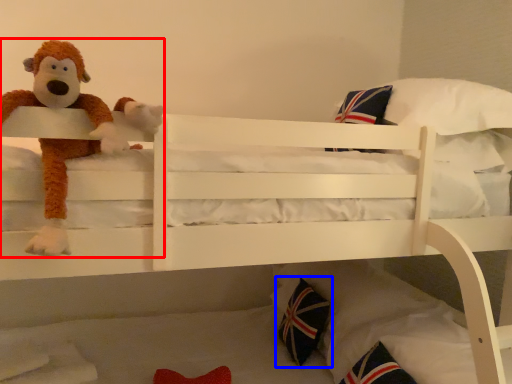
Question: Which object appears farthest to the camera in this image, toy (highlighted by a red box) or throw pillow (highlighted by a blue box)?

Choices:
 (A) toy
 (B) throw pillow

Answer: (B)